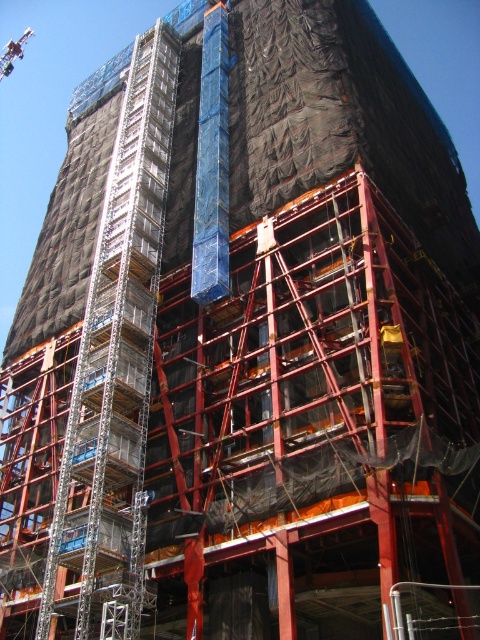
Between point (123, 456) and point (0, 68), which one is positioned in front?

Positioned in front is point (123, 456).

Between metallic scaffolding at left and metallic red crane at upper left, which one is positioned lower?

metallic scaffolding at left is below.

At what (x,y) coordinates should I click in order to perform the action: click on metallic scaffolding at left. Please return your answer as a coordinate pair (x, y). Looking at the image, I should click on (117, 360).